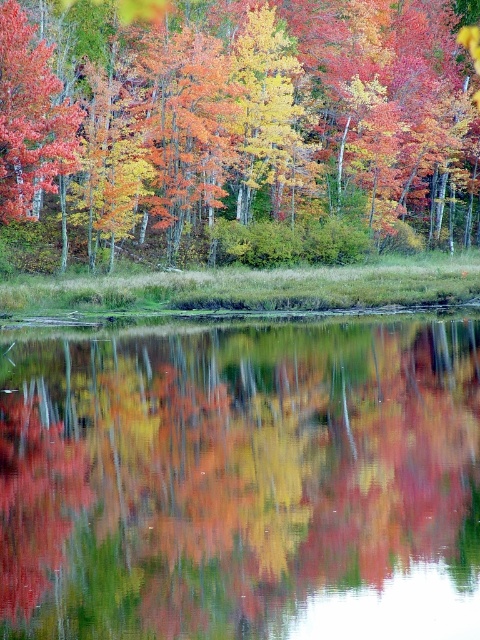
Is transparent glass water at center shorter than autumn leaves at center?

Correct, transparent glass water at center is not as tall as autumn leaves at center.

The image size is (480, 640). What do you see at coordinates (242, 483) in the screenshot?
I see `transparent glass water at center` at bounding box center [242, 483].

The width and height of the screenshot is (480, 640). Describe the element at coordinates (242, 483) in the screenshot. I see `transparent glass water at center` at that location.

Locate an element on the screen. The height and width of the screenshot is (640, 480). transparent glass water at center is located at coordinates (242, 483).